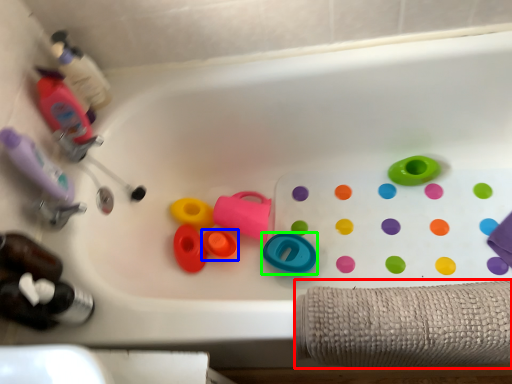
Question: Which object is positioned farthest from bath towel (highlighted by a red box)? Select from toy (highlighted by a blue box) and toy (highlighted by a green box).

Choices:
 (A) toy
 (B) toy

Answer: (A)